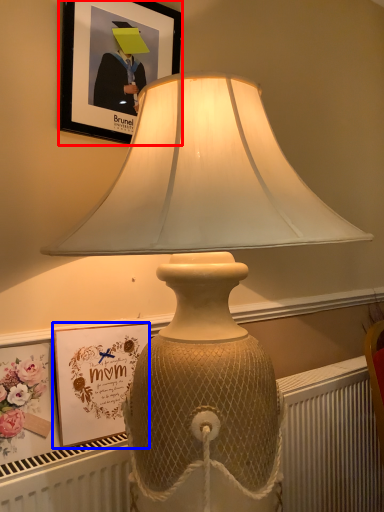
Question: Which object is further to the camera taking this photo, picture frame (highlighted by a red box) or picture frame (highlighted by a blue box)?

Choices:
 (A) picture frame
 (B) picture frame

Answer: (A)